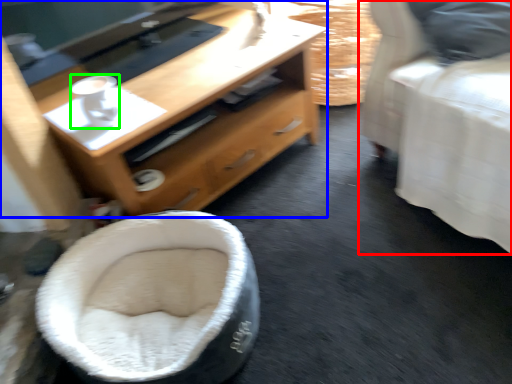
Question: Based on their relative distances, which object is farther from furniture (highlighted by a red box)? Choose from desk (highlighted by a blue box) and coffee (highlighted by a green box).

Choices:
 (A) desk
 (B) coffee

Answer: (B)